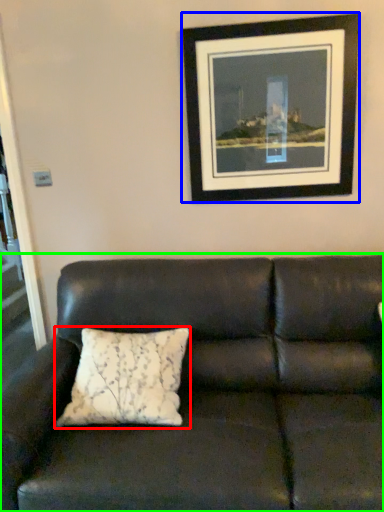
Question: Which object is the farthest from pillow (highlighted by a red box)? Choose among these: picture frame (highlighted by a blue box) or studio couch (highlighted by a green box).

Choices:
 (A) picture frame
 (B) studio couch

Answer: (A)